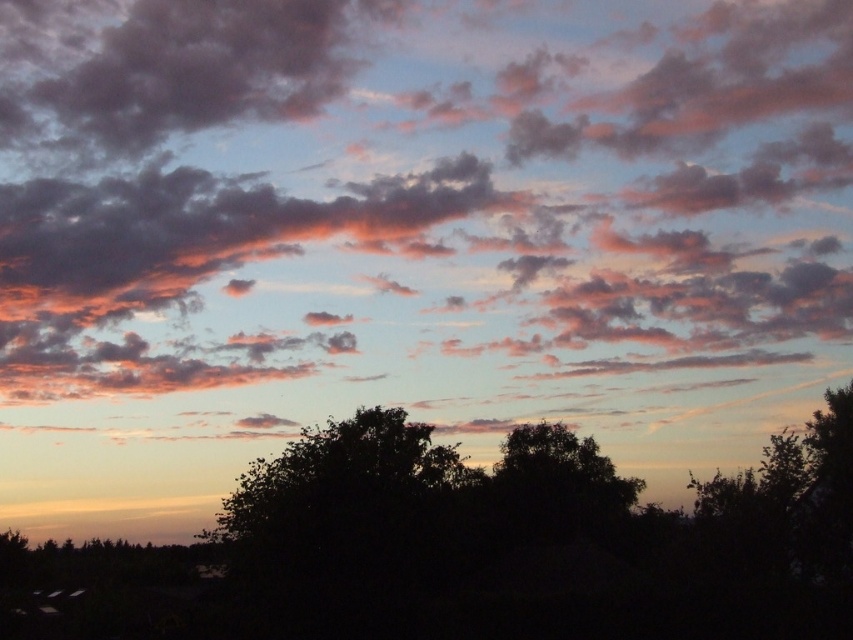
Question: Among these points, which one is nearest to the camera?

Choices:
 (A) (531, 456)
 (B) (628, 244)

Answer: (A)

Question: Where is cloudy sky at upper center located in relation to green leafy tree at center in the image?

Choices:
 (A) above
 (B) below

Answer: (A)

Question: Is cloudy sky at upper center to the right of green leafy tree at center from the viewer's perspective?

Choices:
 (A) yes
 (B) no

Answer: (B)

Question: Is cloudy sky at upper center above green leafy tree at center?

Choices:
 (A) yes
 (B) no

Answer: (A)

Question: Among these points, which one is nearest to the camera?

Choices:
 (A) (531, 513)
 (B) (386, 353)

Answer: (A)